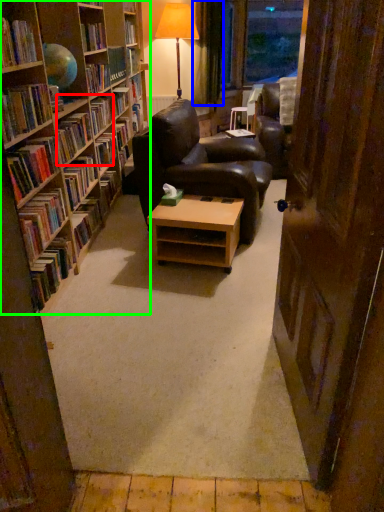
Question: Which is nearer to the book (highlighted by a red box)? curtain (highlighted by a blue box) or bookcase (highlighted by a green box).

Choices:
 (A) curtain
 (B) bookcase

Answer: (B)